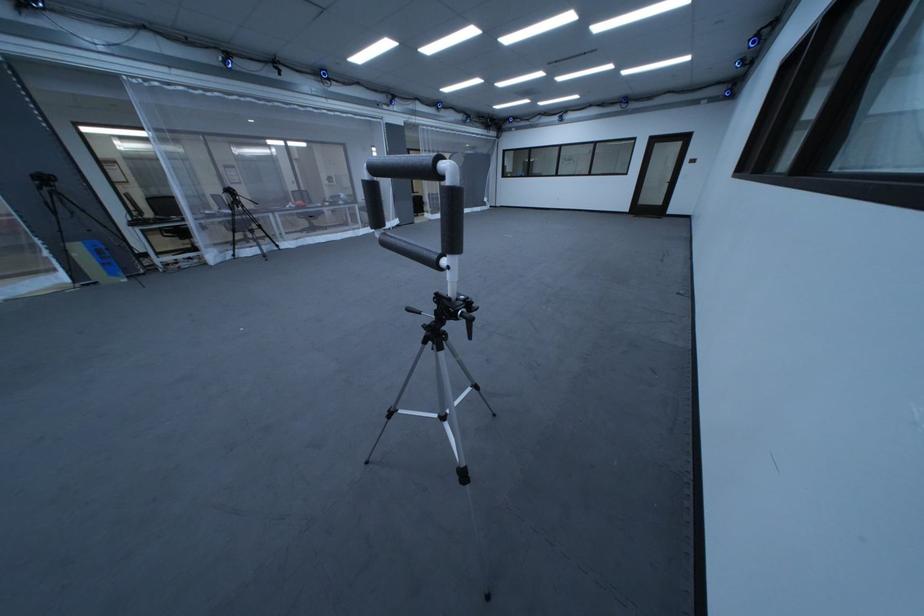
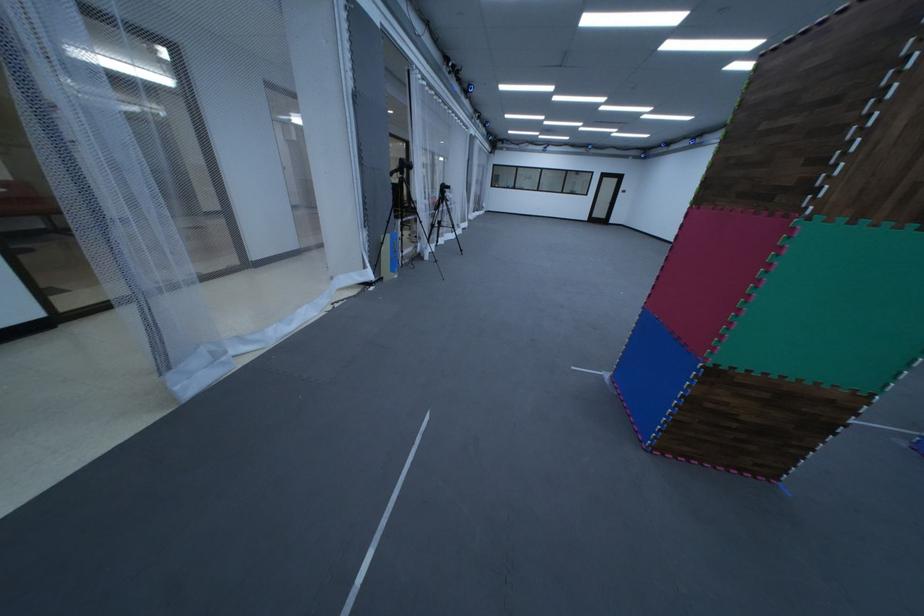
The point at (x=674, y=213) is marked in the first image. Where is the corresponding point in the second image?

(621, 223)